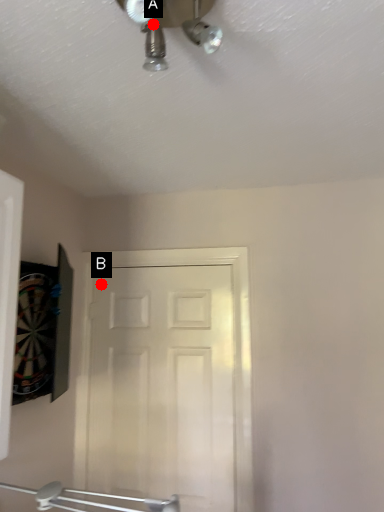
Question: Two points are circled on the image, labeled by A and B beside each circle. Which point is closer to the camera?

Choices:
 (A) A is closer
 (B) B is closer

Answer: (A)